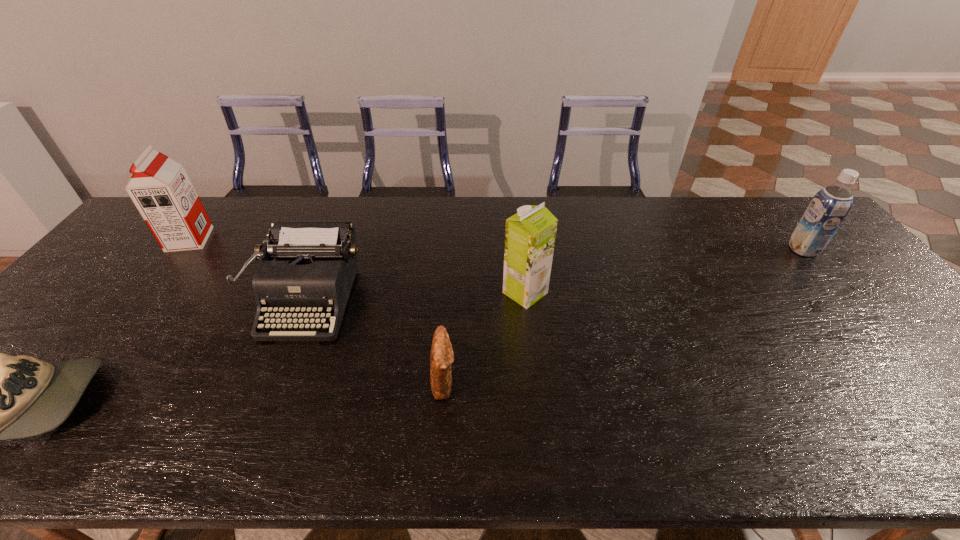
Image resolution: width=960 pixels, height=540 pixels. Identify the location of the leftmost soya milk. (160, 188).

Locate an element on the screen. The height and width of the screenshot is (540, 960). the second object from right to left is located at coordinates (530, 234).

You are a GUI agent. You are given a task and a screenshot of the screen. Output one action in this format:
    pyautogui.click(x=<x>, y=<y>)
    Task: Click on the nearest soya milk
    The width and height of the screenshot is (960, 540).
    Given the screenshot: What is the action you would take?
    point(530,234)

The height and width of the screenshot is (540, 960). I want to click on the rightmost object, so click(829, 207).

At what (x,y) coordinates should I click in order to perform the action: click on the third shortest object. Please return your answer as a coordinate pair (x, y). Looking at the image, I should click on (315, 265).

Image resolution: width=960 pixels, height=540 pixels. What are the coordinates of `typewriter` in the screenshot? It's located at (315, 265).

This screenshot has width=960, height=540. Find the location of `the fourth object from left to right`. the fourth object from left to right is located at coordinates (442, 356).

The image size is (960, 540). Identify the location of clutch bag. (442, 356).

At what (x,y) coordinates should I click in order to perform the action: click on free region located on the front of the leftmost soya milk. Please return your answer as a coordinate pair (x, y). This screenshot has width=960, height=540. Looking at the image, I should click on (158, 279).

Identify the location of blank area located on the front of the nearest soya milk. (540, 442).